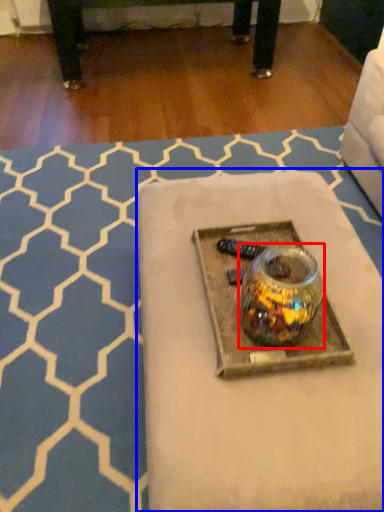
Question: Among these objects, which one is farthest to the camera, glass jar (highlighted by a red box) or table (highlighted by a blue box)?

Choices:
 (A) glass jar
 (B) table

Answer: (B)